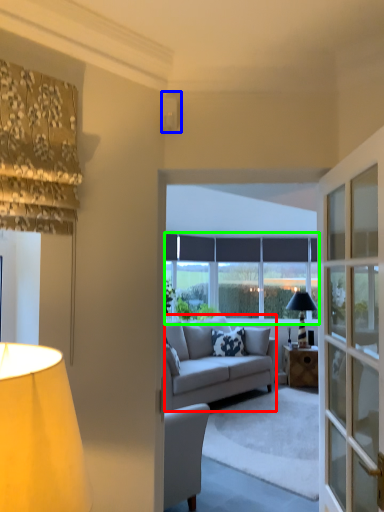
Question: Based on their relative distances, which object is farther from studio couch (highlighted by a red box)? Choose from lamp (highlighted by a blue box) and window (highlighted by a green box).

Choices:
 (A) lamp
 (B) window

Answer: (A)